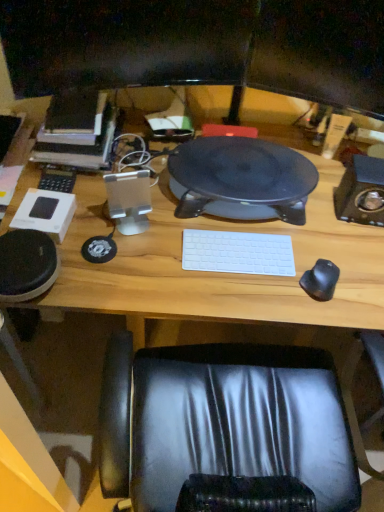
Find the location of a particular element. Image resolution: width=384 pixels, height=512 pixels. free spot to the left of black plastic speaker at center is located at coordinates (116, 168).